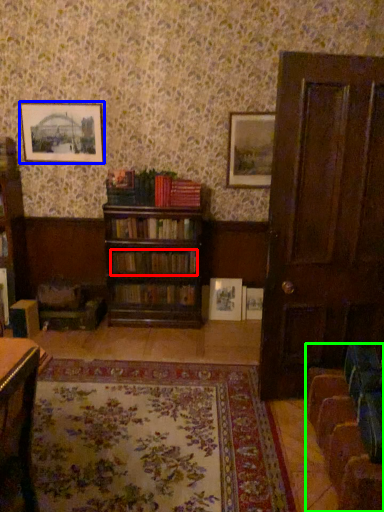
Question: Which object is the farthest from book (highlighted by a red box)? Choose among these: picture frame (highlighted by a blue box) or swivel chair (highlighted by a green box).

Choices:
 (A) picture frame
 (B) swivel chair

Answer: (B)